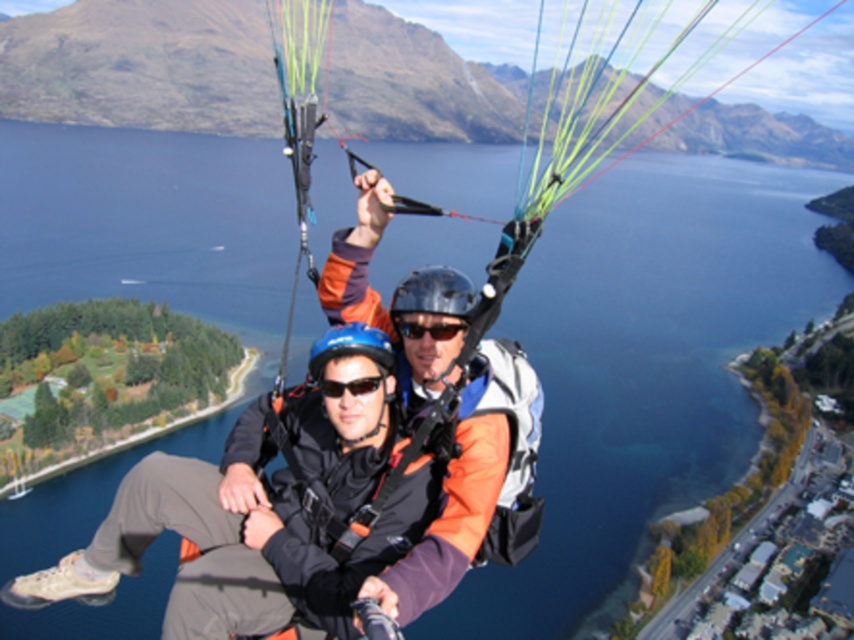
Question: Which is farther from the black matte goggles at center?

Choices:
 (A) black matte sunglasses at center
 (B) orange fabric jacket at center

Answer: (B)

Question: Which point appears farthest from the camera in this image?

Choices:
 (A) (437, 316)
 (B) (305, 520)

Answer: (A)

Question: Among these points, which one is nearest to the camera?

Choices:
 (A) (218, 573)
 (B) (431, 333)

Answer: (A)

Question: Is orange fabric jacket at center below black matte goggles at center?

Choices:
 (A) yes
 (B) no

Answer: (A)

Question: In this image, where is orange fabric jacket at center located relative to black matte sunglasses at center?

Choices:
 (A) above
 (B) below

Answer: (B)

Question: Is the position of orange fabric jacket at center more distant than that of black matte sunglasses at center?

Choices:
 (A) yes
 (B) no

Answer: (B)